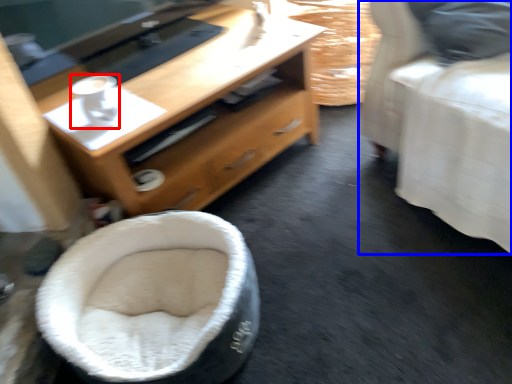
Question: Which of the following is the farthest to the observer, coffee (highlighted by a red box) or furniture (highlighted by a blue box)?

Choices:
 (A) coffee
 (B) furniture

Answer: (A)